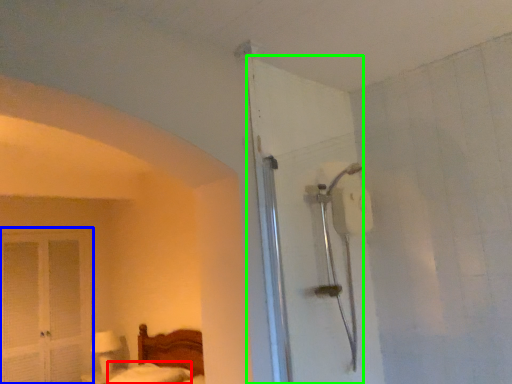
Question: Which object is the farthest from mattress (highlighted by a red box)? Choose among these: screen door (highlighted by a blue box) or door (highlighted by a green box).

Choices:
 (A) screen door
 (B) door

Answer: (B)